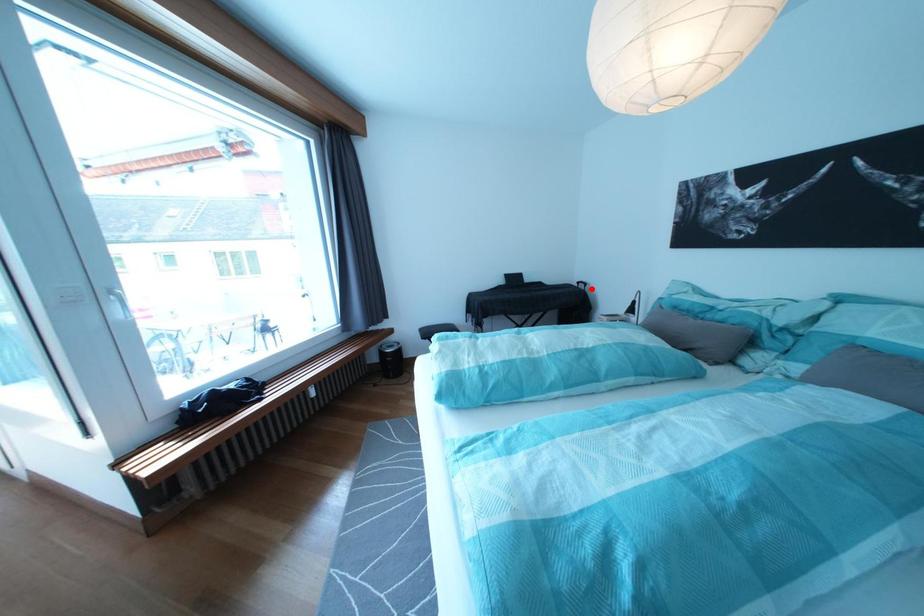
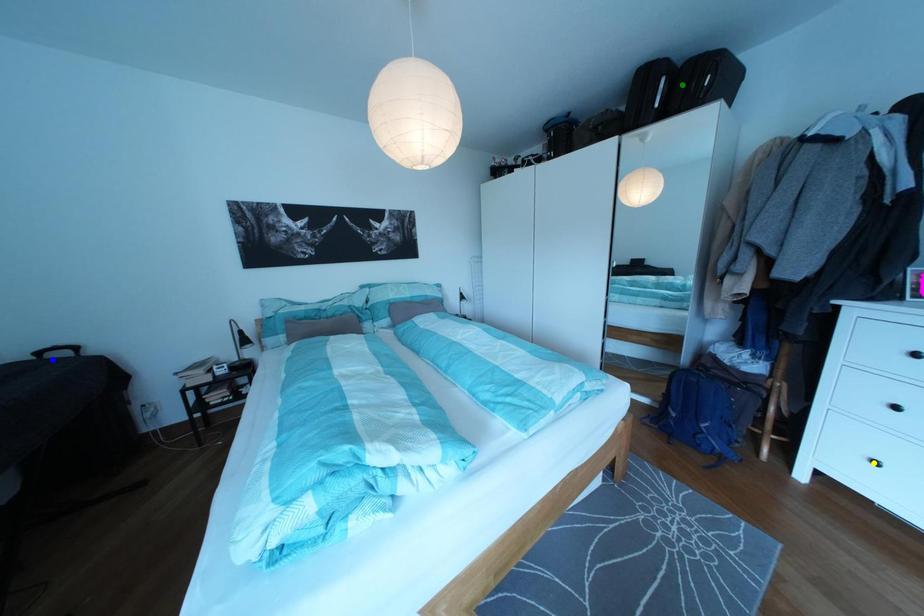
Question: I am providing you with two images of the same scene from different viewpoints. A red point is marked on the first image. You are given multiple points on the second image. Which mark in image 2 goes with the point in image 1?

Choices:
 (A) yellow point
 (B) green point
 (C) blue point

Answer: (C)